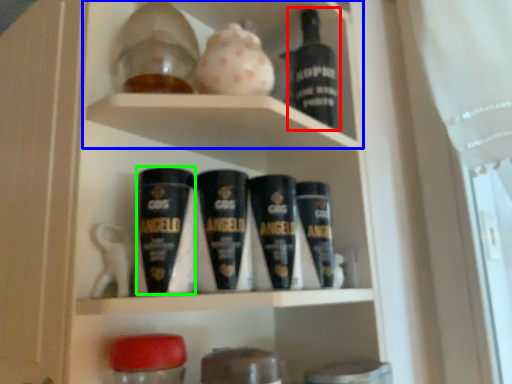
Question: Based on their relative distances, which object is nearer to bottle (highlighted by a red box)? Choose from cabinet (highlighted by a blue box) and shaving cream (highlighted by a green box).

Choices:
 (A) cabinet
 (B) shaving cream

Answer: (A)